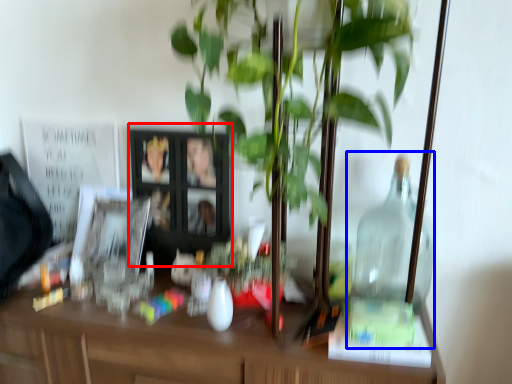
Question: Which object appears farthest to the camera in this image, picture frame (highlighted by a red box) or glass jar (highlighted by a blue box)?

Choices:
 (A) picture frame
 (B) glass jar

Answer: (A)